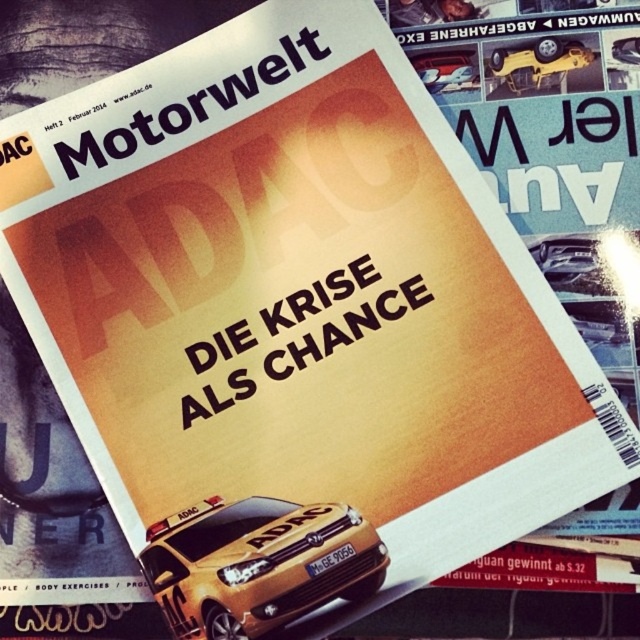
Question: Considering the relative positions of metallic gold car at center and metallic silver car at upper center in the image provided, where is metallic gold car at center located with respect to metallic silver car at upper center?

Choices:
 (A) right
 (B) left

Answer: (B)

Question: Is yellow matte car at upper center to the right of metallic silver car at upper center from the viewer's perspective?

Choices:
 (A) no
 (B) yes

Answer: (B)

Question: Which of these objects is positioned farthest from the metallic silver car at upper center?

Choices:
 (A) metallic gold car at center
 (B) yellow matte car at upper center

Answer: (A)

Question: Which of these objects is positioned closest to the metallic gold car at center?

Choices:
 (A) metallic silver car at upper center
 (B) yellow matte car at upper center

Answer: (A)

Question: Considering the relative positions of yellow matte car at upper center and metallic silver car at upper center in the image provided, where is yellow matte car at upper center located with respect to metallic silver car at upper center?

Choices:
 (A) above
 (B) below

Answer: (A)

Question: Which of the following is the closest to the observer?

Choices:
 (A) yellow matte car at upper center
 (B) metallic silver car at upper center

Answer: (A)